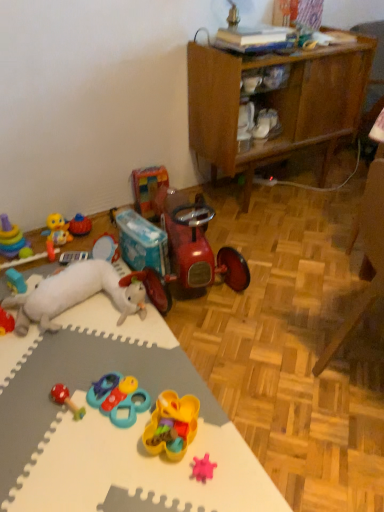
Locate an element on the screen. vacant region under wooden cabinet at upper right (from a real-world perspective) is located at coordinates click(x=263, y=185).